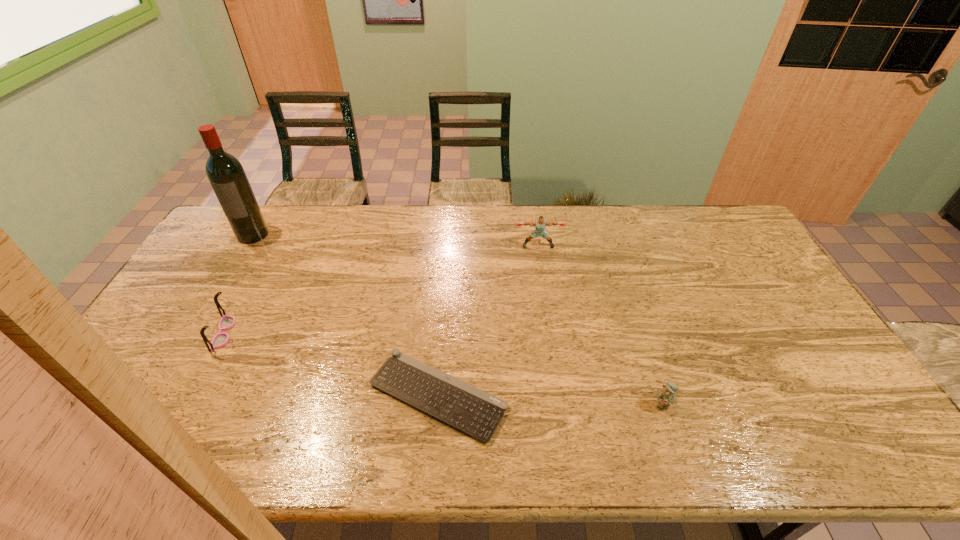
This screenshot has height=540, width=960. I want to click on the tallest object, so click(226, 175).

Identify the location of the fourth object from left to right. The image size is (960, 540). (540, 224).

This screenshot has width=960, height=540. I want to click on puncher, so click(540, 224).

You are a GUI agent. You are given a task and a screenshot of the screen. Output one action in this format:
    pyautogui.click(x=<x>, y=<y>)
    Task: Click on the third shortest object
    The height and width of the screenshot is (540, 960).
    Given the screenshot: What is the action you would take?
    pyautogui.click(x=220, y=339)

Locate an element on the screen. The height and width of the screenshot is (540, 960). the third farthest object is located at coordinates (220, 339).

Locate an element on the screen. the second shortest object is located at coordinates (666, 397).

At what (x,y) coordinates should I click in order to perform the action: click on teddy bear. Please return your answer as a coordinate pair (x, y). The width and height of the screenshot is (960, 540). Looking at the image, I should click on (666, 397).

Locate an element on the screen. the shortest object is located at coordinates (467, 408).

This screenshot has width=960, height=540. Identify the location of computer keyboard. (467, 408).

The height and width of the screenshot is (540, 960). Identify the location of vacant region located on the label of the wine bottle. (231, 272).